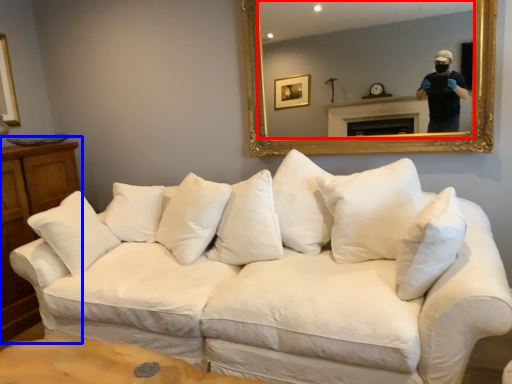
Question: Which of the following is the farthest to the observer, mirror (highlighted by a red box) or dresser (highlighted by a blue box)?

Choices:
 (A) mirror
 (B) dresser

Answer: (B)